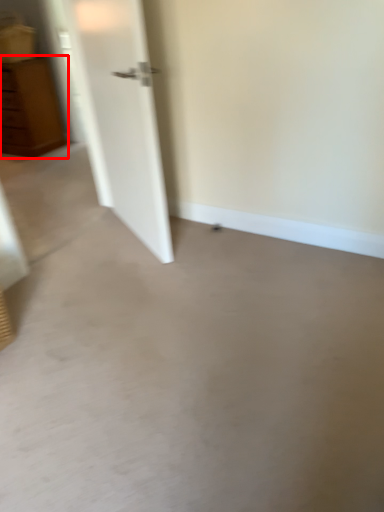
Question: From the image's perspective, what is the correct spatial positioning of chest of drawers (annotated by the red box) in reference to concrete?

Choices:
 (A) above
 (B) below

Answer: (A)